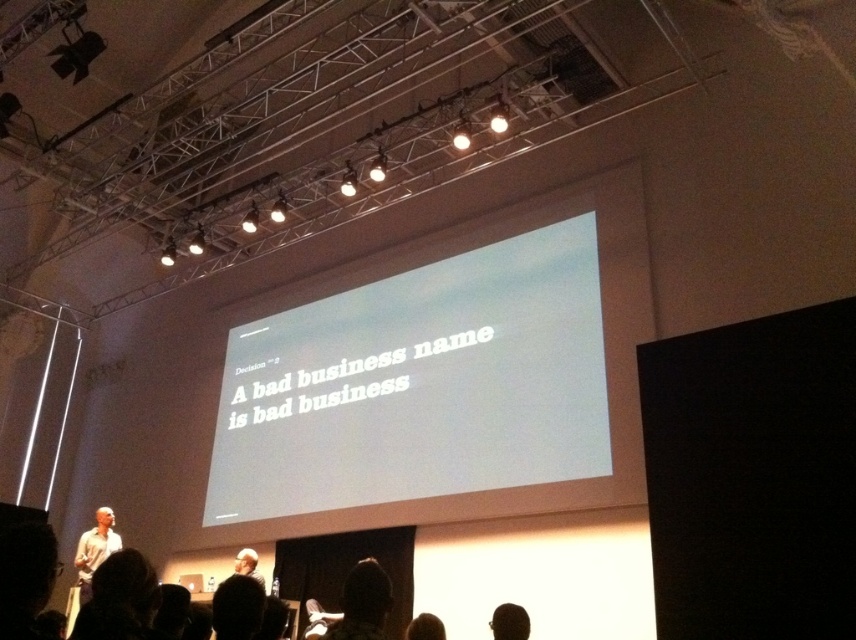
You are an event planner setting up a new projector. The projector you have can only project onto a surface that is within a 1 meter radius of the point at center. Is the white matte projection screen at center within this radius?

The white matte projection screen at center is located at point (x=419, y=385), so it is within the 1 meter radius of the center point. Therefore, the projector can project onto it.